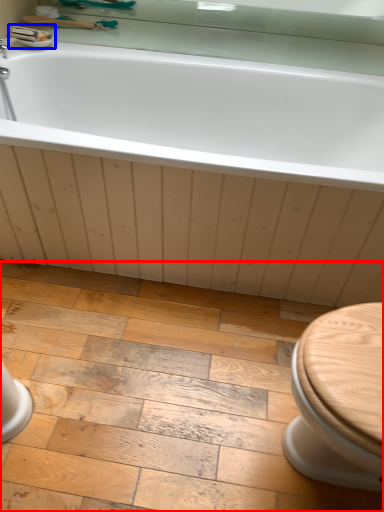
Question: Which object is further to the camera taking this photo, ceramic tile (highlighted by a red box) or sink (highlighted by a blue box)?

Choices:
 (A) ceramic tile
 (B) sink

Answer: (B)